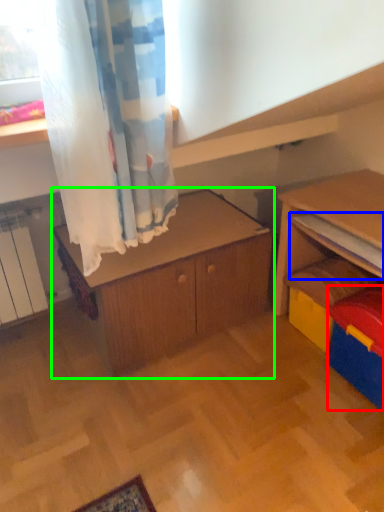
Question: Estimate the real-world distances between objects in this image. Which object is closer to storage box (highlighted by a red box), shelf (highlighted by a blue box) or cabinetry (highlighted by a green box)?

Choices:
 (A) shelf
 (B) cabinetry

Answer: (A)